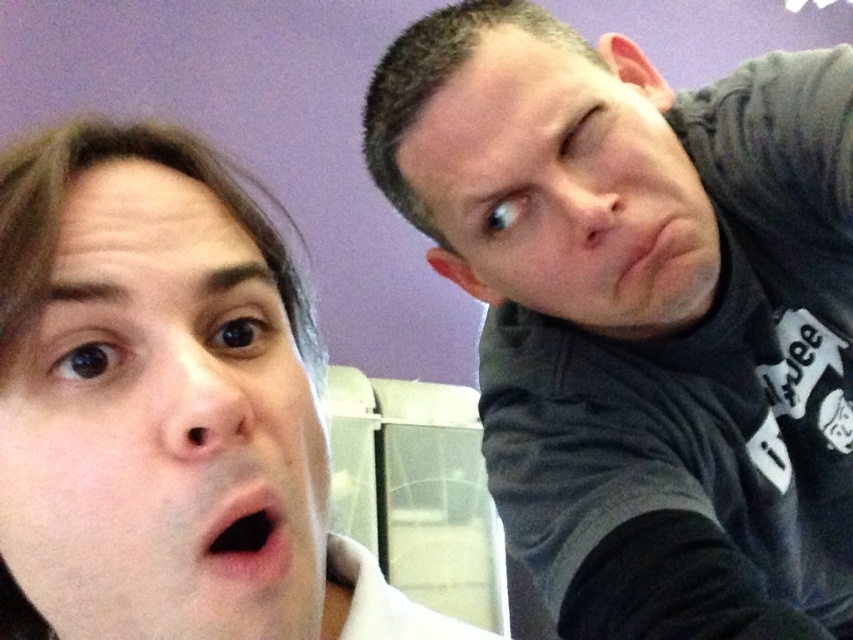
Question: Which point is closer to the camera?

Choices:
 (A) (253, 502)
 (B) (517, 198)
 (C) (599, 513)
 (D) (656, 212)

Answer: (A)

Question: Can you confirm if smooth skin face at left is positioned below matte black face at upper right?

Choices:
 (A) yes
 (B) no

Answer: (A)

Question: Can you confirm if dark gray hoodie at upper right is positioned below matte skin at upper right?

Choices:
 (A) yes
 (B) no

Answer: (A)

Question: Which point appears closest to the camera in this image?

Choices:
 (A) coord(724,358)
 (B) coord(102,310)
 (C) coord(251,566)

Answer: (C)

Question: Is smooth skin face at left wider than matte skin at upper right?

Choices:
 (A) yes
 (B) no

Answer: (B)

Question: Which point is farther to the camera?

Choices:
 (A) (572, 152)
 (B) (192, 253)

Answer: (A)